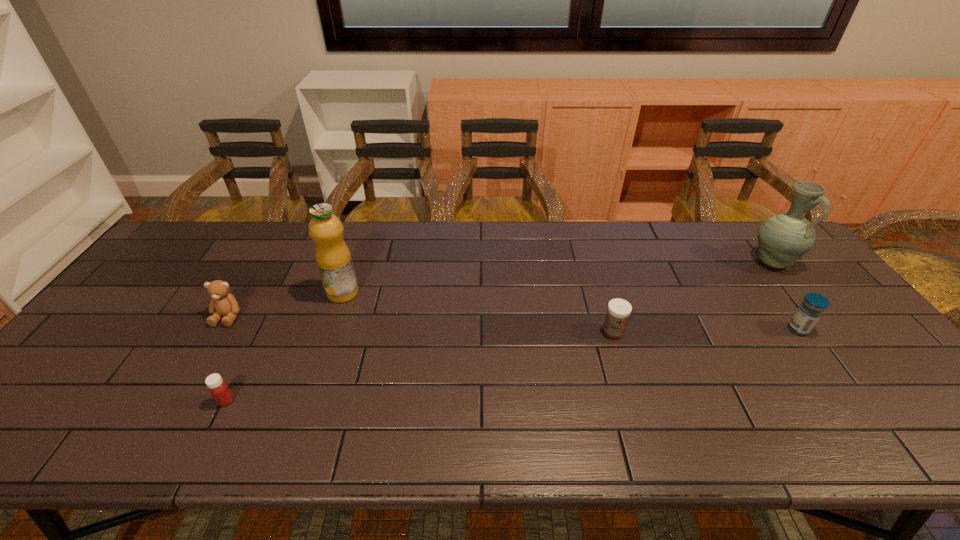
In order to click on free space at the left edge of the desktop in this screenshot , I will do `click(93, 385)`.

Locate an element on the screen. free space at the right edge of the desktop is located at coordinates (843, 369).

I want to click on free space at the far left corner of the desktop, so click(x=181, y=244).

Where is `vacant space at the near right corner of the desktop`? This screenshot has height=540, width=960. vacant space at the near right corner of the desktop is located at coordinates click(934, 430).

Where is `free space that is in between the leftmost object and the second medicine from right to left`? The width and height of the screenshot is (960, 540). free space that is in between the leftmost object and the second medicine from right to left is located at coordinates (420, 324).

Locate an element on the screen. The image size is (960, 540). vacant space in between the second medicine from left to right and the rightmost medicine is located at coordinates (706, 330).

Find the location of a particular element. vacant space in between the nearest medicine and the teddy bear is located at coordinates click(228, 359).

Locate an element on the screen. Image resolution: width=960 pixels, height=540 pixels. vacant area that lies between the fifth object from right to left and the farthest object is located at coordinates (499, 331).

The height and width of the screenshot is (540, 960). In order to click on vacant space that is in between the fourth object from right to left and the pitcher in this screenshot , I will do `click(558, 277)`.

I want to click on free space between the rightmost medicine and the second farthest object, so click(570, 311).